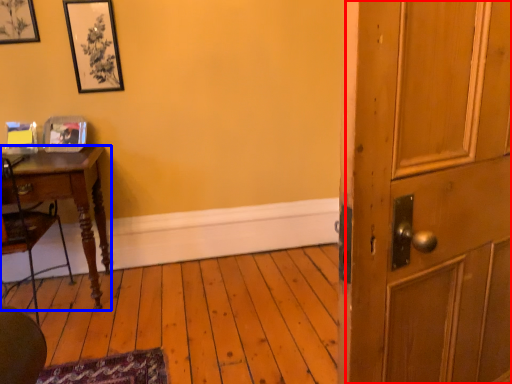
Question: Which of the following is the farthest to the observer, barn door (highlighted by a red box) or desk (highlighted by a blue box)?

Choices:
 (A) barn door
 (B) desk

Answer: (B)